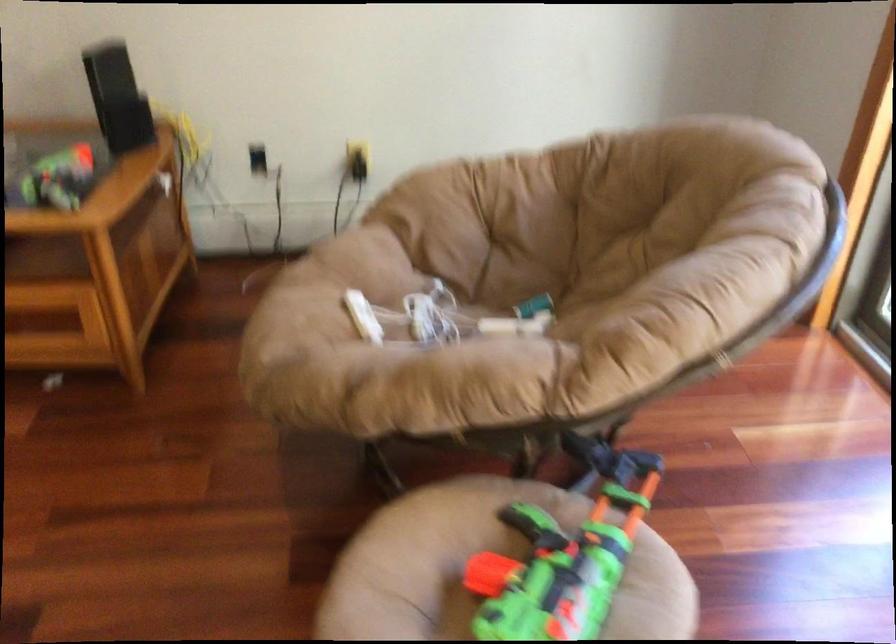
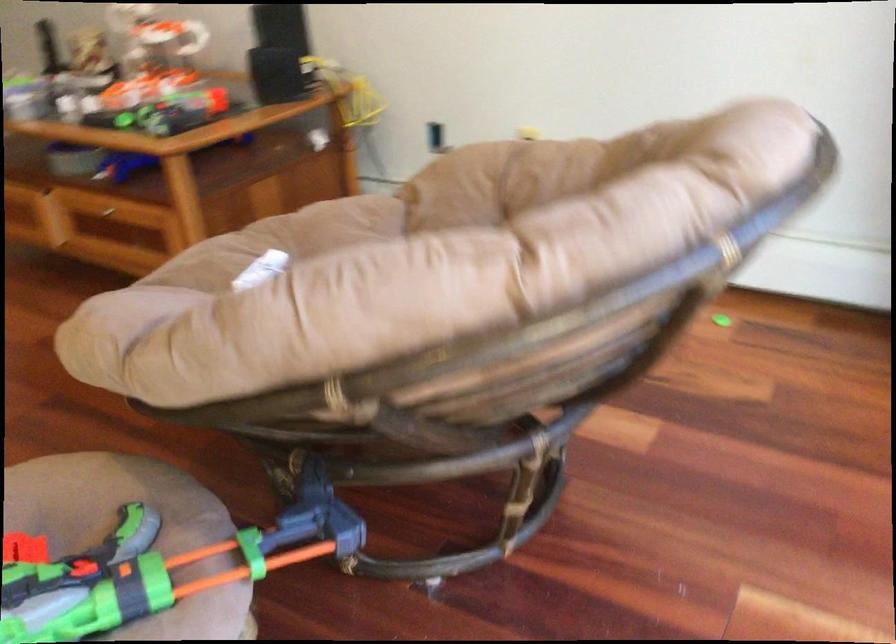
Question: I am providing you with two images of the same scene from different viewpoints. Which of the following objects are not visible in image2?

Choices:
 (A) small glass sphere
 (B) stool sitting surface
 (C) white game controller
 (D) chair sitting surface

Answer: (C)